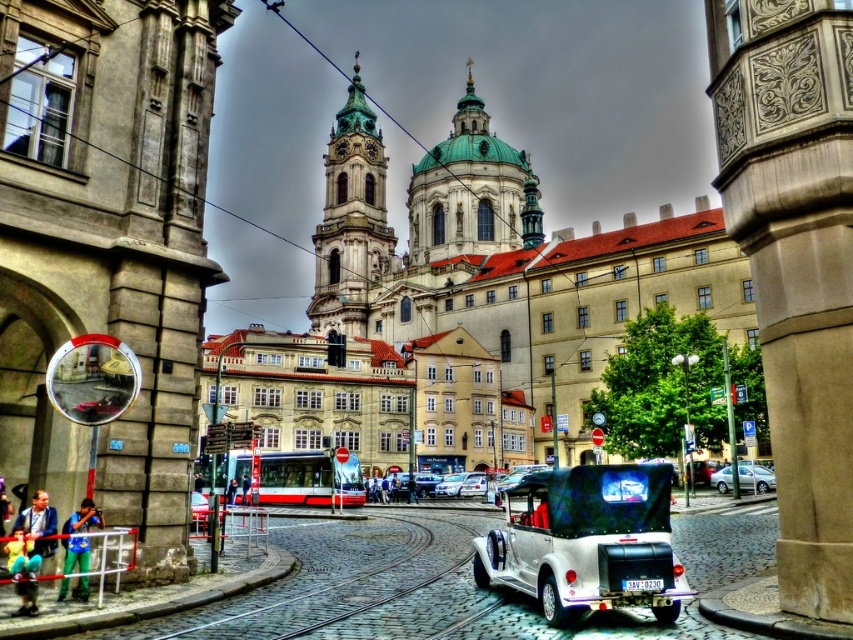
Does brown textured pillar at center right appear under green glazed tile dome at center?

Yes.

The width and height of the screenshot is (853, 640). Identify the location of brown textured pillar at center right. (795, 262).

I want to click on brown textured pillar at center right, so click(795, 262).

Is the position of metallic silver car at center less distant than that of green glazed tile bell tower at center?

That is True.

Who is more distant from viewer, (544, 470) or (368, 278)?

The point (368, 278) is more distant.

Identify the location of metallic silver car at center. The image size is (853, 640). (587, 541).

Between point (759, 236) and point (766, 481), which one is positioned in front?

Positioned in front is point (759, 236).

Is brown textured pillar at center right above silver metallic sedan at lower right?

Indeed, brown textured pillar at center right is positioned over silver metallic sedan at lower right.

Where is `brown textured pillar at center right`? The image size is (853, 640). brown textured pillar at center right is located at coordinates (795, 262).

Locate an element on the screen. brown textured pillar at center right is located at coordinates (795, 262).